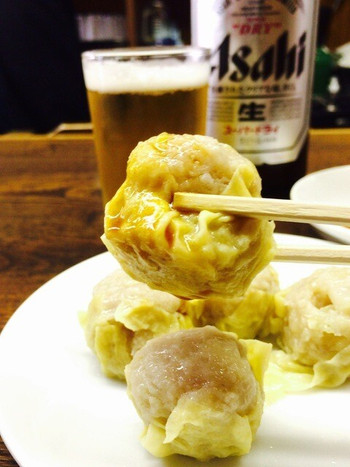
You are a GUI agent. You are given a task and a screenshot of the screen. Output one action in this format:
    pyautogui.click(x=<x>, y=<y>)
    Task: Click on the plant
    This screenshot has height=467, width=350.
    Given the screenshot: What is the action you would take?
    (x=326, y=55)